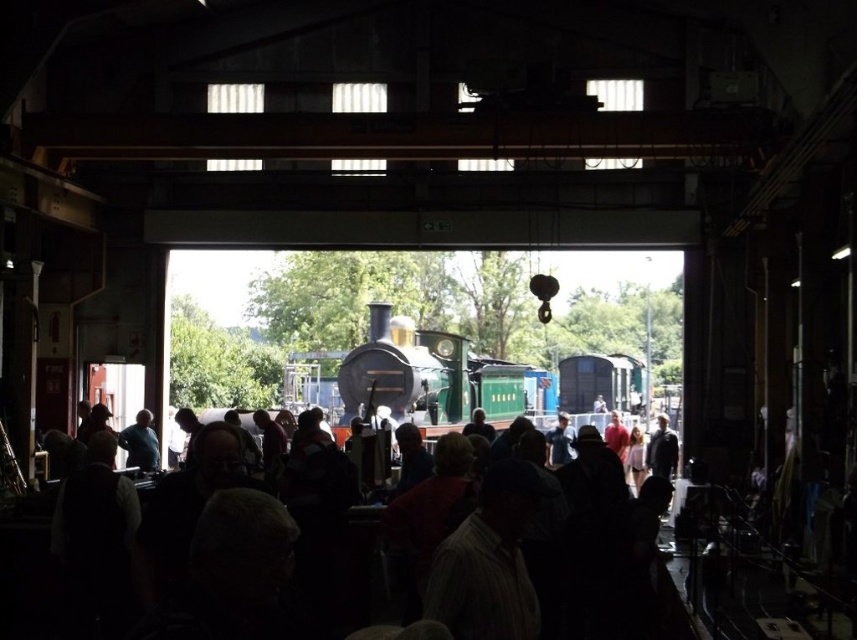
Question: Which of the following is the farthest from the observer?

Choices:
 (A) matte blue shirt at left
 (B) dark fabric crowd at center
 (C) polished black locomotive at center

Answer: (C)

Question: Is polished black locomotive at center wider than matte blue shirt at left?

Choices:
 (A) yes
 (B) no

Answer: (A)

Question: Which point is closer to the camera?

Choices:
 (A) polished black locomotive at center
 (B) matte blue shirt at left
 (C) dark fabric crowd at center

Answer: (C)

Question: Observing the image, what is the correct spatial positioning of polished black locomotive at center in reference to matte blue shirt at left?

Choices:
 (A) right
 (B) left

Answer: (A)

Question: Which of the following is the farthest from the observer?

Choices:
 (A) polished black locomotive at center
 (B) dark fabric crowd at center
 (C) matte blue shirt at left

Answer: (A)

Question: Is dark fabric crowd at center above polished black locomotive at center?

Choices:
 (A) yes
 (B) no

Answer: (B)